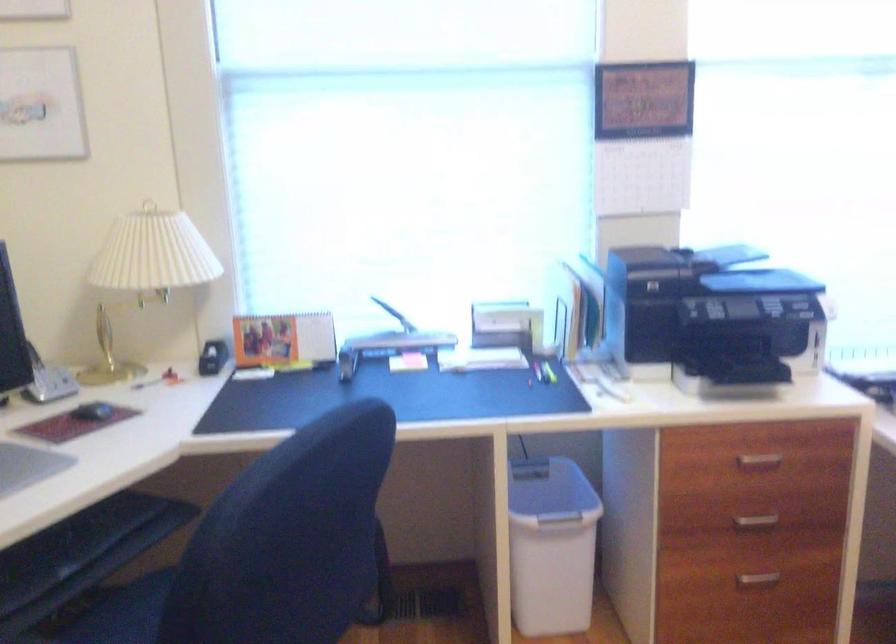
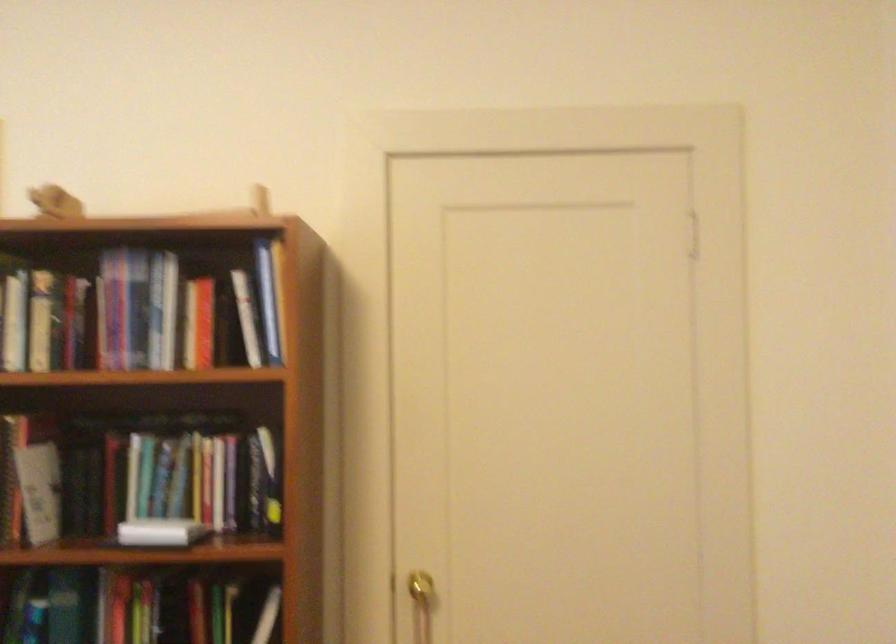
Question: Based on the continuous images, in which direction is the camera rotating? Reply with the corresponding letter.

Choices:
 (A) Left
 (B) Right
 (C) Up
 (D) Down

Answer: (B)